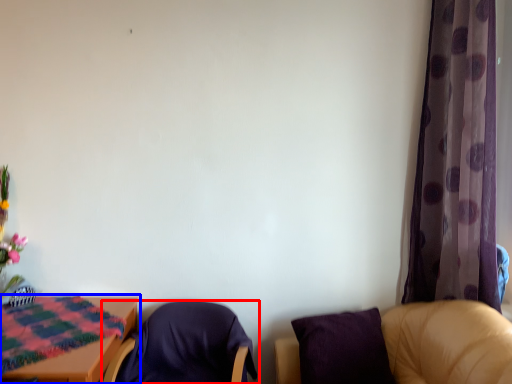
Question: Which object is closer to the camera taking this photo, chair (highlighted by a red box) or table (highlighted by a blue box)?

Choices:
 (A) chair
 (B) table

Answer: (B)